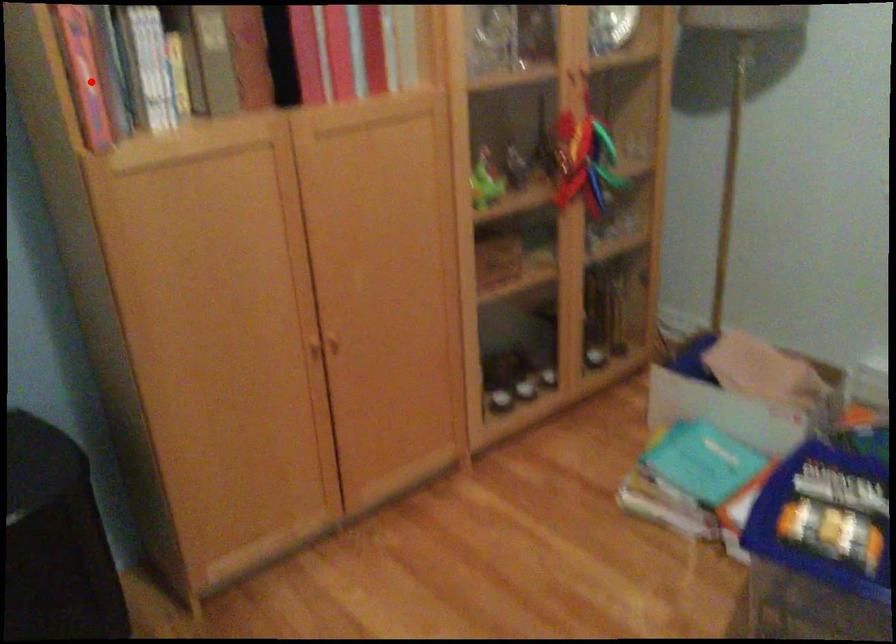
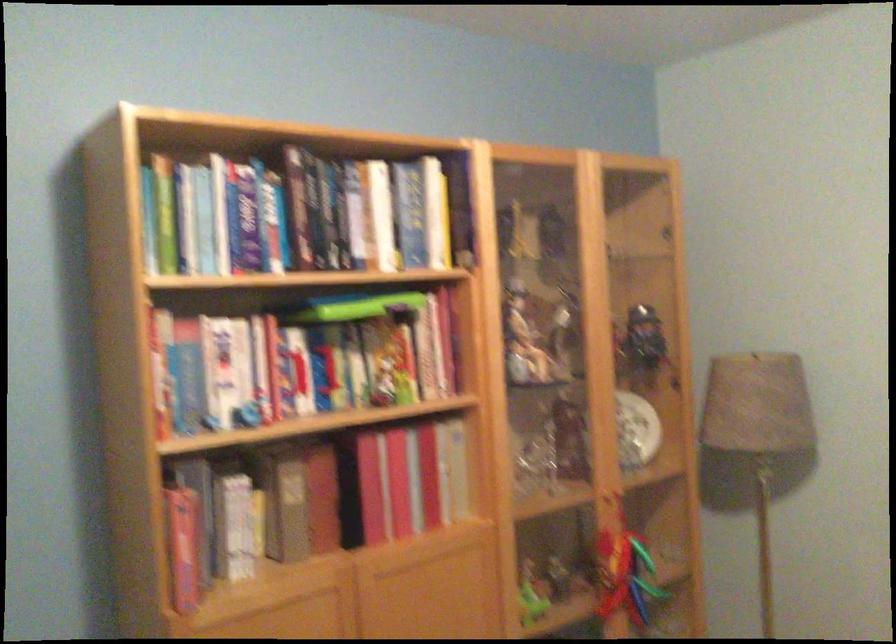
Question: I am providing you with two images of the same scene from different viewpoints. A red point is shown in image1. For the corresponding object point in image2, is it positioned nearer or farther from the camera?

Choices:
 (A) Nearer
 (B) Farther

Answer: (B)